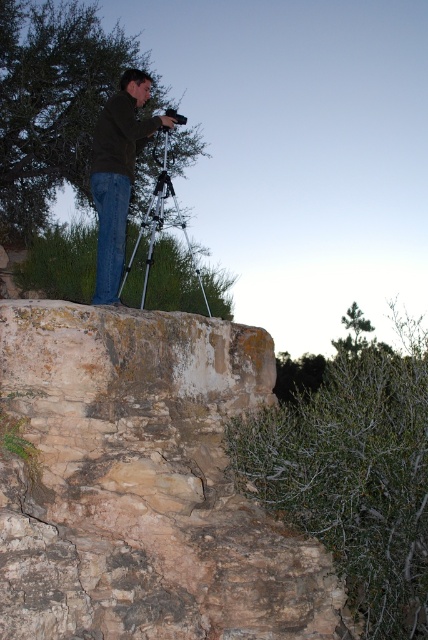
You are a photographer trying to frame a shot of the rustic stone cliff at center and the dark brown leather jacket at center. Which object is wider in the scene?

The rustic stone cliff at center is wider than the dark brown leather jacket at center.